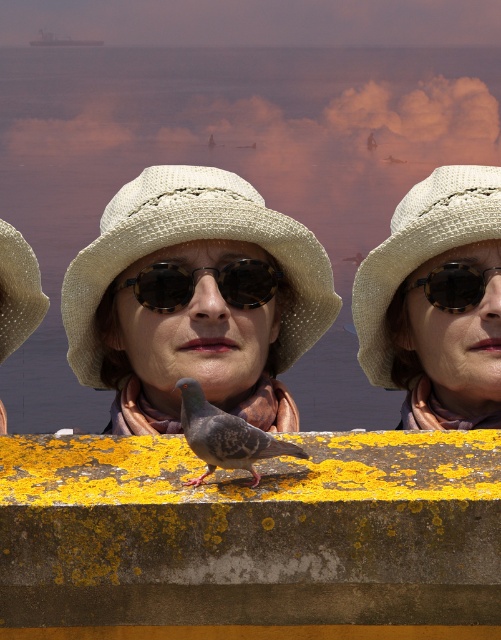
What are the coordinates of the gray speckled pigeon at center in the image?

The gray speckled pigeon at center is located at coordinates 0.681 and 0.449.

You are a photographer trying to capture the scene with the gray speckled pigeon at center and the beige straw hat at center. Which object is located to the right side of the other?

The gray speckled pigeon at center is positioned on the right side of beige straw hat at center.

You are a photographer trying to capture a shot of the gray speckled pigeon at center and the tortoiseshell plastic goggles at center. Based on their positions, which object is closer to the left edge of the frame?

The gray speckled pigeon at center is to the left of the tortoiseshell plastic goggles at center, so the gray speckled pigeon at center is closer to the left edge of the frame.